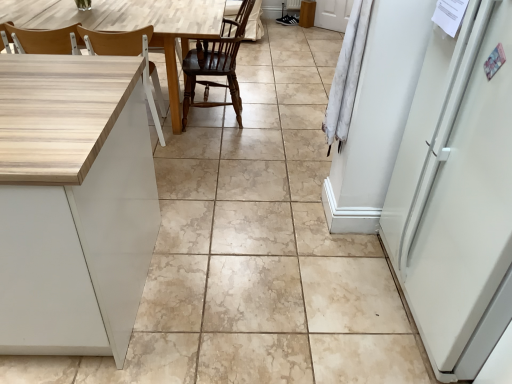
Locate an element on the screen. vacant space to the right of dark wood chair at center, which is the first chair from right to left is located at coordinates (276, 120).